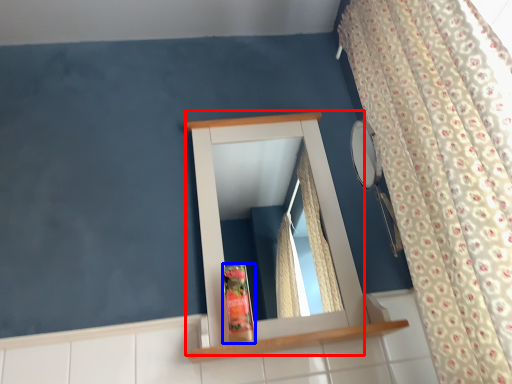
Question: Which of the following is the farthest to the observer, medicine cabinet (highlighted by a red box) or toiletry (highlighted by a blue box)?

Choices:
 (A) medicine cabinet
 (B) toiletry

Answer: (B)